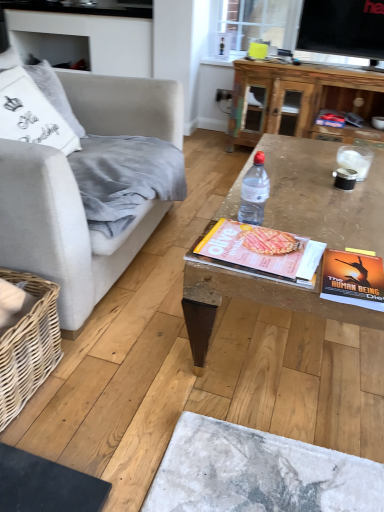
Find the location of a particular element. The image size is (384, 512). wooden coffee table at upper center is located at coordinates (301, 95).

You are a GUI agent. You are given a task and a screenshot of the screen. Output one action in this format:
    pyautogui.click(x=<x>, y=<y>)
    Task: Click on the wooden coffee table at center
    The width and height of the screenshot is (384, 512).
    Given the screenshot: What is the action you would take?
    pyautogui.click(x=322, y=195)

What do you see at coordinates (62, 230) in the screenshot? Image resolution: width=384 pixels, height=512 pixels. I see `light gray fabric couch at left` at bounding box center [62, 230].

What do you see at coordinates (28, 345) in the screenshot? Image resolution: width=384 pixels, height=512 pixels. I see `woven wood basket at lower left` at bounding box center [28, 345].

The image size is (384, 512). I want to click on wooden coffee table at upper center, so click(x=301, y=95).

From a real-world perspective, is hardcover book at center right on top of woven wood basket at lower left?

Yes, from a real-world perspective, hardcover book at center right is on top of woven wood basket at lower left.

Which object is thinner, hardcover book at center right or woven wood basket at lower left?

hardcover book at center right.

Between hardcover book at center right and woven wood basket at lower left, which one is positioned in front?

Positioned in front is woven wood basket at lower left.

Does hardcover book at center right have a smaller size compared to woven wood basket at lower left?

Yes.

Does wooden coffee table at center appear on the left side of woven wood basket at lower left?

No, wooden coffee table at center is not to the left of woven wood basket at lower left.

Based on their sizes in the image, would you say wooden coffee table at center is bigger or smaller than woven wood basket at lower left?

wooden coffee table at center is bigger than woven wood basket at lower left.

Is wooden coffee table at center outside of woven wood basket at lower left?

wooden coffee table at center is positioned outside woven wood basket at lower left.

Where is `basket below the wooden coffee table at center (from the image's perspective)`? Image resolution: width=384 pixels, height=512 pixels. basket below the wooden coffee table at center (from the image's perspective) is located at coordinates (28, 345).

Considering the relative positions of light gray fabric couch at left and hardcover book at center right in the image provided, is light gray fabric couch at left to the left of hardcover book at center right from the viewer's perspective?

Indeed, light gray fabric couch at left is positioned on the left side of hardcover book at center right.

Would you say light gray fabric couch at left is outside hardcover book at center right?

Yes, light gray fabric couch at left is outside of hardcover book at center right.

From the image's perspective, is light gray fabric couch at left on hardcover book at center right?

Yes, from the image's perspective, light gray fabric couch at left is above hardcover book at center right.

Is the surface of light gray fabric couch at left in direct contact with hardcover book at center right?

light gray fabric couch at left is not next to hardcover book at center right, and they're not touching.

Could you tell me if woven wood basket at lower left is turned towards matte yellow magazine at center?

Yes, woven wood basket at lower left faces towards matte yellow magazine at center.

Considering the relative sizes of woven wood basket at lower left and matte yellow magazine at center in the image provided, is woven wood basket at lower left shorter than matte yellow magazine at center?

No, woven wood basket at lower left is not shorter than matte yellow magazine at center.

Considering the relative sizes of woven wood basket at lower left and matte yellow magazine at center in the image provided, is woven wood basket at lower left thinner than matte yellow magazine at center?

Correct, the width of woven wood basket at lower left is less than that of matte yellow magazine at center.

Is wooden coffee table at center wider than hardcover book at center right?

Yes, wooden coffee table at center is wider than hardcover book at center right.

Identify the location of coffee table on the right of hardcover book at center right. (322, 195).

Considering the positions of point (364, 205) and point (328, 276), is point (364, 205) closer or farther from the camera than point (328, 276)?

Clearly, point (364, 205) is more distant from the camera than point (328, 276).

Is wooden coffee table at center inside the boundaries of hardcover book at center right, or outside?

wooden coffee table at center lies outside hardcover book at center right.

Is hardcover book at center right oriented towards wooden coffee table at upper center?

No.

Between hardcover book at center right and wooden coffee table at upper center, which one appears on the left side from the viewer's perspective?

hardcover book at center right is more to the left.

Is point (358, 286) closer to camera compared to point (332, 96)?

Yes, point (358, 286) is in front of point (332, 96).

Measure the distance from hardcover book at center right to wooden coffee table at upper center.

hardcover book at center right and wooden coffee table at upper center are 2.25 meters apart from each other.

Image resolution: width=384 pixels, height=512 pixels. I want to click on table beneath the clear plastic bottle at center (from a real-world perspective), so click(301, 95).

How distant is clear plastic bottle at center from wooden coffee table at upper center?

1.93 meters.

Does clear plastic bottle at center contain wooden coffee table at upper center?

No.

From a real-world perspective, is clear plastic bottle at center over wooden coffee table at upper center?

Yes, from a real-world perspective, clear plastic bottle at center is on top of wooden coffee table at upper center.

There is a woven wood basket at lower left. Where is `paperback book above it (from a real-world perspective)`? Image resolution: width=384 pixels, height=512 pixels. paperback book above it (from a real-world perspective) is located at coordinates (353, 279).

The height and width of the screenshot is (512, 384). Find the location of `coffee table above the woven wood basket at lower left (from the image's perspective)`. coffee table above the woven wood basket at lower left (from the image's perspective) is located at coordinates (322, 195).

From the picture: When comparing their distances from matte yellow magazine at center, does hardcover book at center right or wooden coffee table at upper center seem further?

Based on the image, wooden coffee table at upper center appears to be further to matte yellow magazine at center.

When comparing their distances from wooden coffee table at upper center, does wooden coffee table at center or clear plastic bottle at center seem further?

clear plastic bottle at center is further to wooden coffee table at upper center.

Looking at the image, which one is located further to wooden coffee table at center, woven wood basket at lower left or hardcover book at center right?

The object further to wooden coffee table at center is woven wood basket at lower left.

When comparing their distances from matte yellow magazine at center, does clear plastic bottle at center or woven wood basket at lower left seem further?

woven wood basket at lower left is further to matte yellow magazine at center.

When comparing their distances from hardcover book at center right, does wooden coffee table at center or matte yellow magazine at center seem closer?

matte yellow magazine at center.

Based on their spatial positions, is light gray fabric couch at left or matte yellow magazine at center closer to woven wood basket at lower left?

Among the two, light gray fabric couch at left is located nearer to woven wood basket at lower left.

Considering their positions, is woven wood basket at lower left positioned closer to light gray fabric couch at left than wooden coffee table at upper center?

woven wood basket at lower left is positioned closer to the anchor light gray fabric couch at left.

Looking at the image, which one is located closer to light gray fabric couch at left, matte yellow magazine at center or wooden coffee table at upper center?

matte yellow magazine at center is positioned closer to the anchor light gray fabric couch at left.

This screenshot has height=512, width=384. I want to click on paperback book between woven wood basket at lower left and wooden coffee table at upper center from front to back, so (353, 279).

Identify the location of bottle located between woven wood basket at lower left and wooden coffee table at upper center in the depth direction. (254, 192).

Locate an element on the screen. bottle between woven wood basket at lower left and wooden coffee table at center is located at coordinates (254, 192).

Where is `paperback book between wooden coffee table at center and wooden coffee table at upper center along the z-axis`? paperback book between wooden coffee table at center and wooden coffee table at upper center along the z-axis is located at coordinates (353, 279).